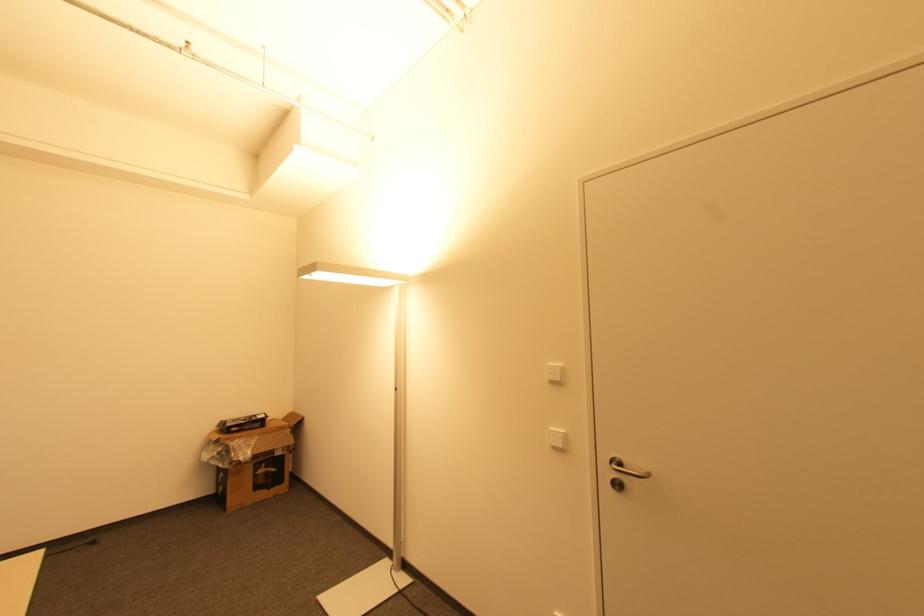
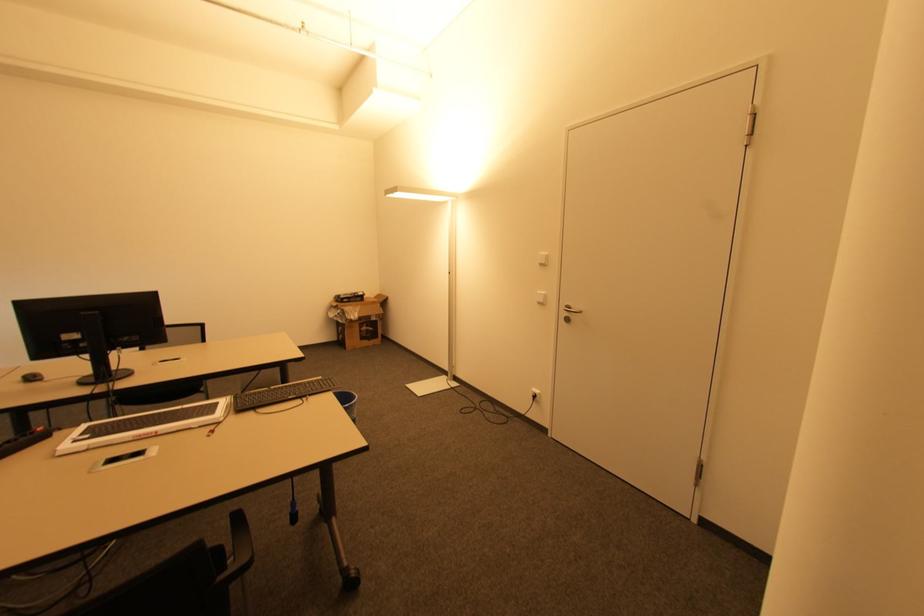
Locate, in the second image, the point that corresponds to [621,487] in the first image.

(568, 320)